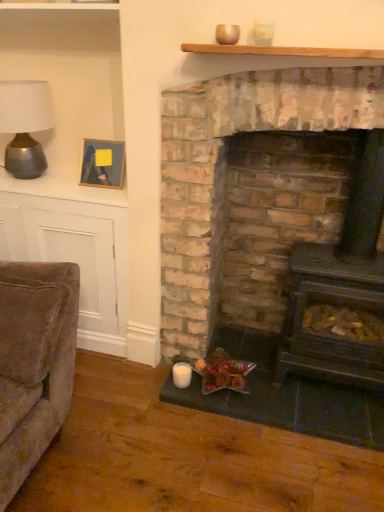
Where is `free space above wooden mantle at upper center (from a real-world perspective)`? The height and width of the screenshot is (512, 384). free space above wooden mantle at upper center (from a real-world perspective) is located at coordinates (270, 45).